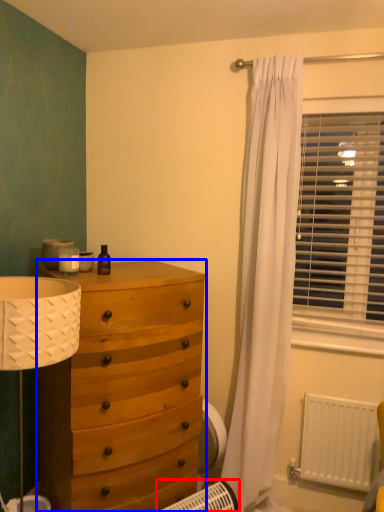
Question: Which point is closer to the camera, heater (highlighted by a red box) or chest of drawers (highlighted by a blue box)?

Choices:
 (A) heater
 (B) chest of drawers

Answer: (A)